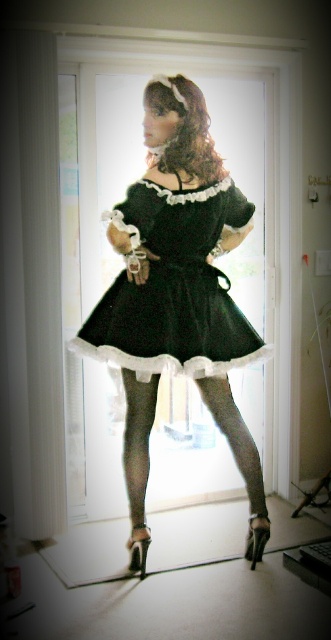
Question: Does black satin dress at center have a lesser width compared to gray tights at center?

Choices:
 (A) yes
 (B) no

Answer: (B)

Question: Does gray tights at center have a lesser width compared to black satin stocking at lower center?

Choices:
 (A) yes
 (B) no

Answer: (B)

Question: Which of the following is the closest to the observer?

Choices:
 (A) gray tights at center
 (B) black velvet dress at center
 (C) black sheer stocking at lower center

Answer: (B)

Question: Considering the real-world distances, which object is farthest from the black sheer stocking at lower center?

Choices:
 (A) black satin stocking at lower center
 (B) black velvet dress at center
 (C) gray tights at center
 (D) black satin dress at center

Answer: (B)

Question: Among these points, which one is farthest from the camera?

Choices:
 (A) (143, 552)
 (B) (138, 433)

Answer: (A)

Question: Can you confirm if black satin dress at center is positioned above black satin stocking at lower center?

Choices:
 (A) no
 (B) yes

Answer: (B)